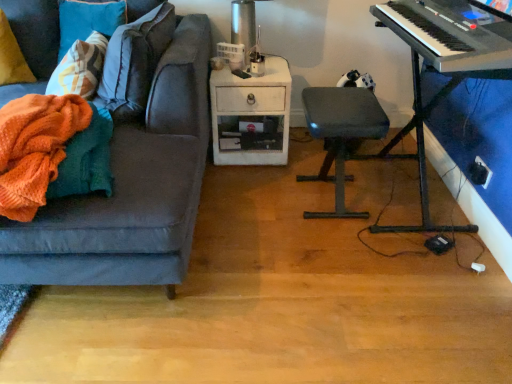
This screenshot has width=512, height=384. I want to click on free space that is in between matte gray stool at center and black plastic keyboard at right, so click(337, 228).